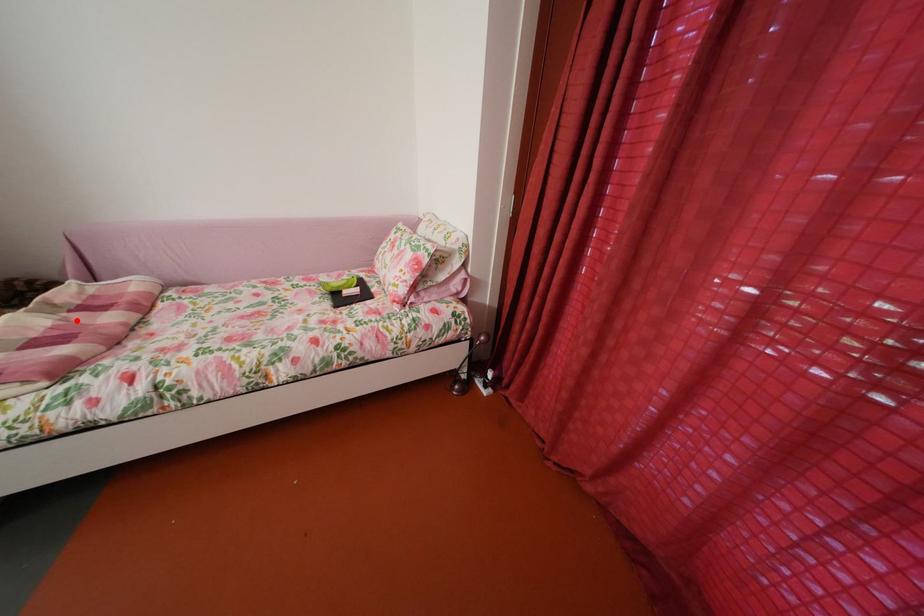
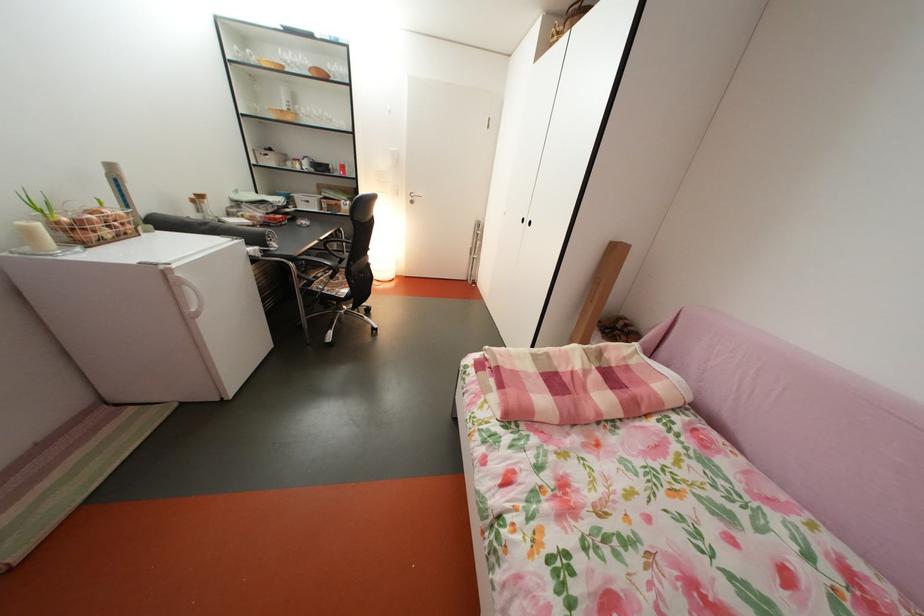
The point at the highlighted location is marked in the first image. Where is the corresponding point in the second image?

(604, 374)